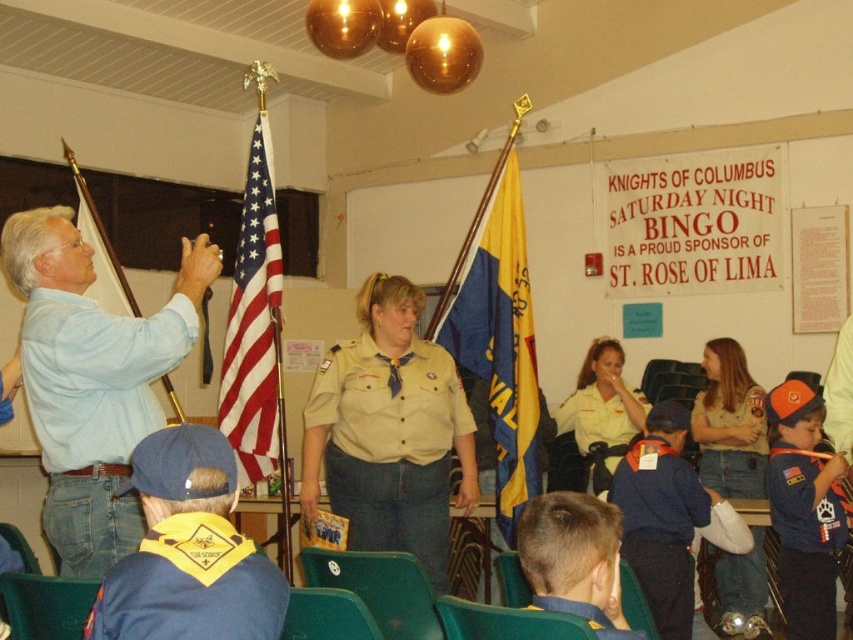
Question: Does yellow cloth neckerchief at lower left have a greater width compared to blue cotton shirt at center?

Choices:
 (A) no
 (B) yes

Answer: (B)

Question: Which object is positioned closest to the light blue cotton shirt at left?

Choices:
 (A) khaki uniform at center
 (B) yellow cloth neckerchief at lower left
 (C) blue cotton shirt at lower right
 (D) blue uniform at center

Answer: (B)

Question: Considering the relative positions of blue cotton shirt at lower right and blue uniform at center in the image provided, where is blue cotton shirt at lower right located with respect to blue uniform at center?

Choices:
 (A) left
 (B) right

Answer: (B)

Question: Among these objects, which one is farthest from the camera?

Choices:
 (A) tan uniform at center
 (B) yellow cloth neckerchief at lower left
 (C) yellow fabric flag at center
 (D) blue uniform at center

Answer: (C)

Question: Is khaki uniform at center thinner than blue cotton shirt at center?

Choices:
 (A) no
 (B) yes

Answer: (A)

Question: Which point appears farthest from the camera in this image?

Choices:
 (A) (514, 266)
 (B) (113, 637)

Answer: (A)